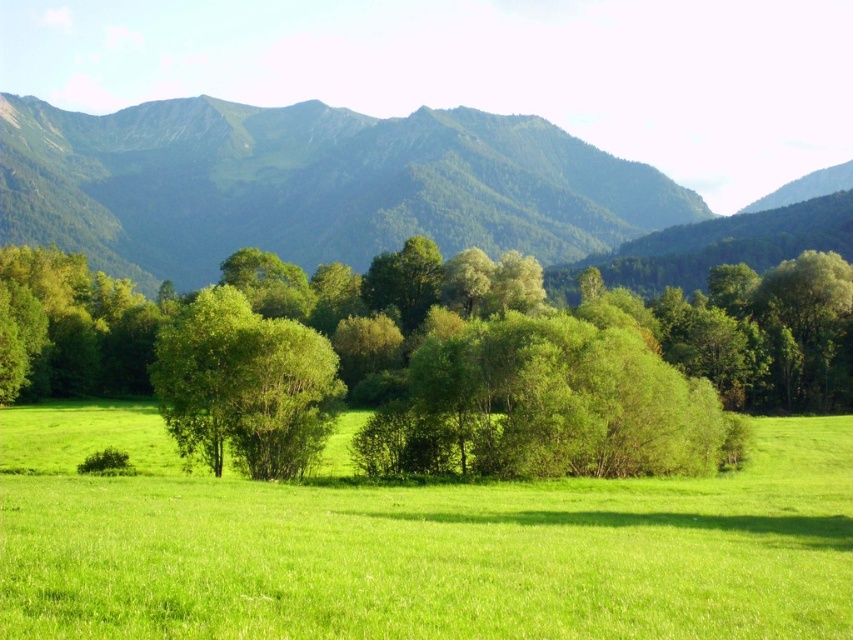
Question: Which object appears farthest from the camera in this image?

Choices:
 (A) green leafy tree at center
 (B) green grass pasture at center
 (C) green textured mountain range at upper center

Answer: (C)

Question: Estimate the real-world distances between objects in this image. Which object is closer to the green textured mountain range at upper center?

Choices:
 (A) green leafy tree at center
 (B) green grass pasture at center

Answer: (A)

Question: Can you confirm if green grass pasture at center is positioned below green textured mountain range at upper center?

Choices:
 (A) no
 (B) yes

Answer: (B)

Question: Among these points, which one is nearest to the camera?

Choices:
 (A) (140, 541)
 (B) (515, 221)
 (C) (308, 422)

Answer: (A)

Question: Is green grass pasture at center to the left of green textured mountain range at upper center from the viewer's perspective?

Choices:
 (A) yes
 (B) no

Answer: (B)

Question: Does green leafy tree at center have a larger size compared to green textured mountain range at upper center?

Choices:
 (A) no
 (B) yes

Answer: (A)